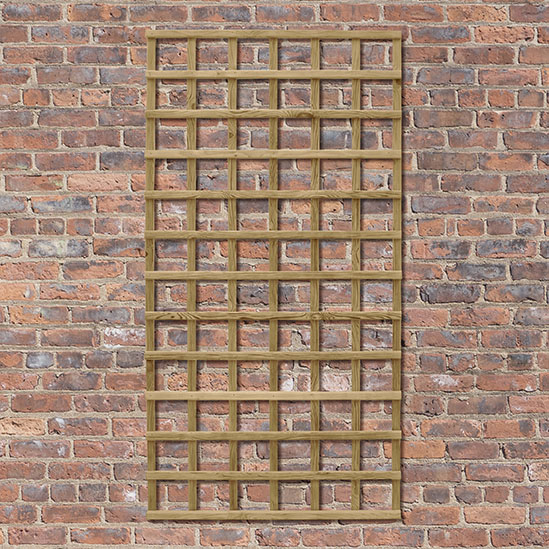
Locate an element on the screen. bare wall is located at coordinates (503, 204).